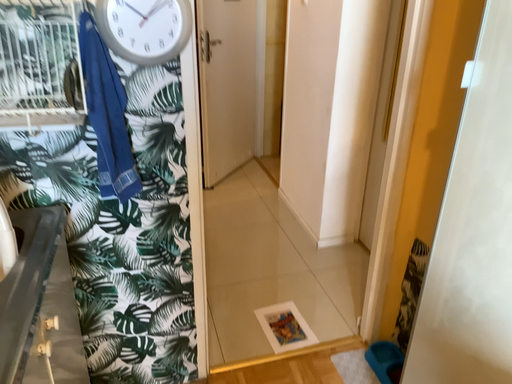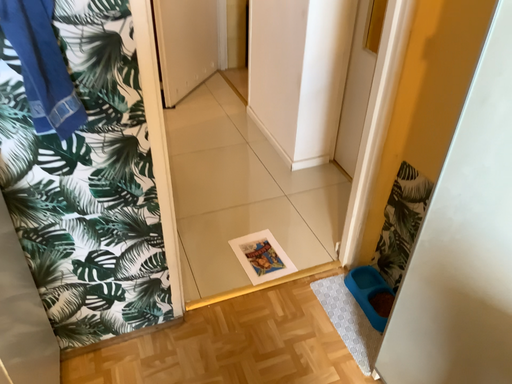
Question: How did the camera likely rotate when shooting the video?

Choices:
 (A) rotated downward
 (B) rotated upward

Answer: (A)